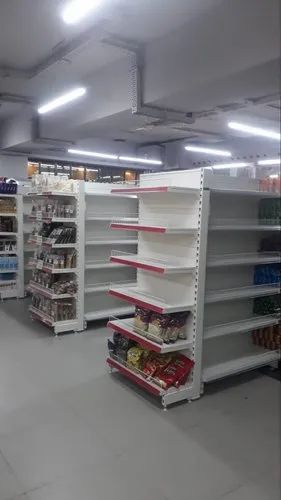
Locate an element on the screen. This screenshot has width=281, height=500. empty shelves is located at coordinates (139, 296), (141, 261), (140, 224), (140, 188).